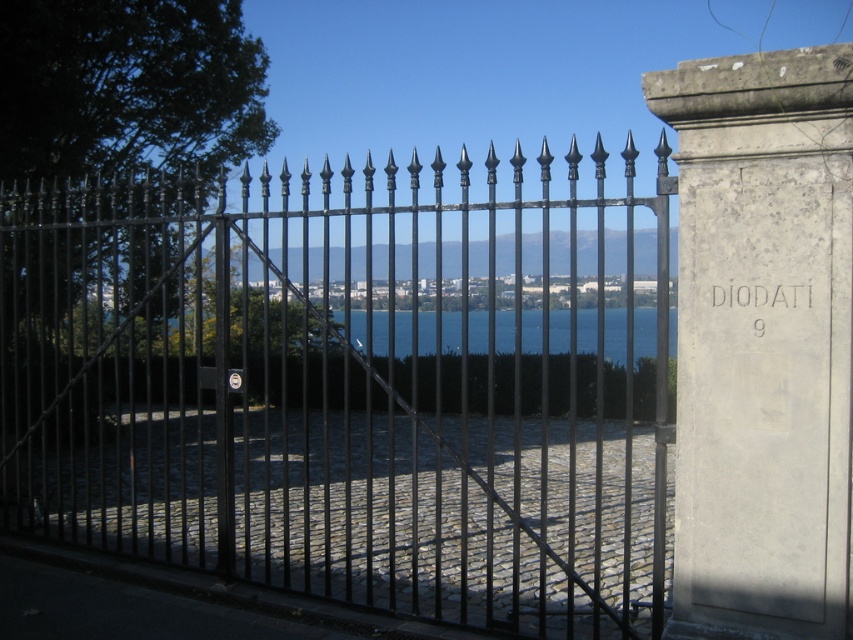
Question: Which point is closer to the camera?

Choices:
 (A) (160, 417)
 (B) (563, 340)

Answer: (A)

Question: Which of the following is the closest to the observer?

Choices:
 (A) black wrought iron fence at center
 (B) blue glass water at center

Answer: (A)

Question: Is black wrought iron fence at center closer to the viewer compared to blue glass water at center?

Choices:
 (A) yes
 (B) no

Answer: (A)

Question: Can you confirm if black wrought iron fence at center is positioned above blue glass water at center?

Choices:
 (A) yes
 (B) no

Answer: (A)

Question: Can you confirm if black wrought iron fence at center is bigger than blue glass water at center?

Choices:
 (A) no
 (B) yes

Answer: (B)

Question: Which point appears closest to the camera in this image?

Choices:
 (A) (428, 316)
 (B) (254, 289)

Answer: (B)